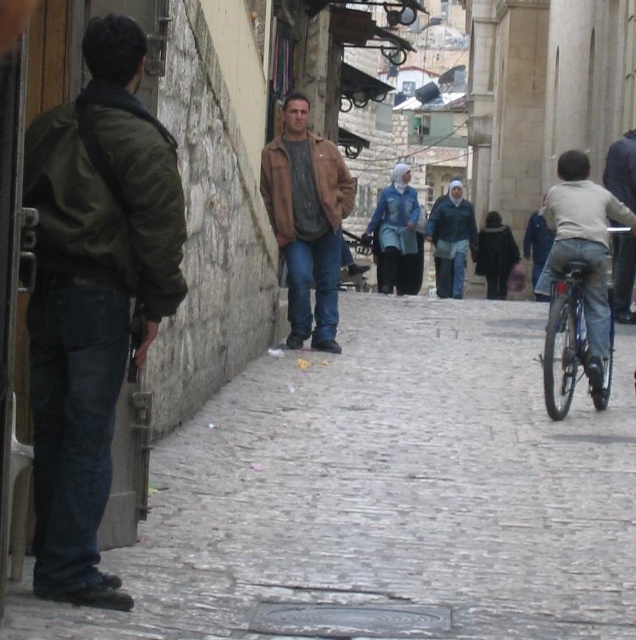
Which is below, brown leather jacket at center or light beige jersey at right?

Positioned lower is brown leather jacket at center.

Does brown leather jacket at center have a lesser height compared to light beige jersey at right?

Indeed, brown leather jacket at center has a lesser height compared to light beige jersey at right.

Which is behind, point (336, 308) or point (563, 276)?

Positioned behind is point (336, 308).

This screenshot has height=640, width=636. What are the coordinates of `brown leather jacket at center` in the screenshot? It's located at (307, 220).

Can you confirm if blue fabric headscarf at center is wider than light brown leather jacket at center?

Yes.

Which of these two, blue fabric headscarf at center or light brown leather jacket at center, stands shorter?

light brown leather jacket at center

Locate an element on the screen. Image resolution: width=636 pixels, height=640 pixels. blue fabric headscarf at center is located at coordinates (396, 234).

In the scene shown: How far apart are green matte jacket at left and light beige jersey at right?

green matte jacket at left and light beige jersey at right are 11.21 meters apart.

Can you confirm if green matte jacket at left is bigger than light beige jersey at right?

Actually, green matte jacket at left might be smaller than light beige jersey at right.

Identify the location of green matte jacket at left. (93, 296).